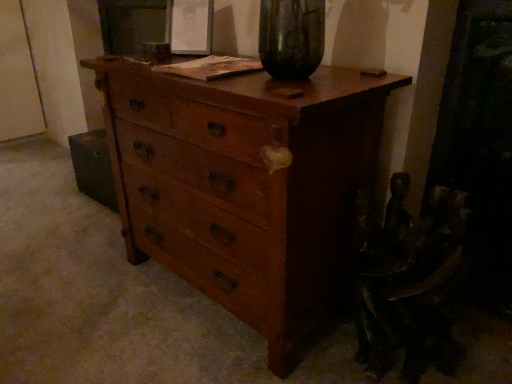
Question: Is wooden swivel chair at lower right wider or thinner than wooden chest of drawers at center?

Choices:
 (A) thin
 (B) wide

Answer: (A)

Question: Relative to wooden chest of drawers at center, is wooden swivel chair at lower right in front or behind?

Choices:
 (A) behind
 (B) front

Answer: (A)

Question: From the image's perspective, is wooden swivel chair at lower right above or below wooden chest of drawers at center?

Choices:
 (A) above
 (B) below

Answer: (B)

Question: Relative to wooden swivel chair at lower right, is wooden chest of drawers at center in front or behind?

Choices:
 (A) front
 (B) behind

Answer: (A)

Question: Choose the correct answer: Is wooden chest of drawers at center inside wooden swivel chair at lower right or outside it?

Choices:
 (A) outside
 (B) inside

Answer: (A)

Question: From their relative heights in the image, would you say wooden chest of drawers at center is taller or shorter than wooden swivel chair at lower right?

Choices:
 (A) tall
 (B) short

Answer: (A)

Question: From a real-world perspective, is wooden chest of drawers at center above or below wooden swivel chair at lower right?

Choices:
 (A) below
 (B) above

Answer: (B)